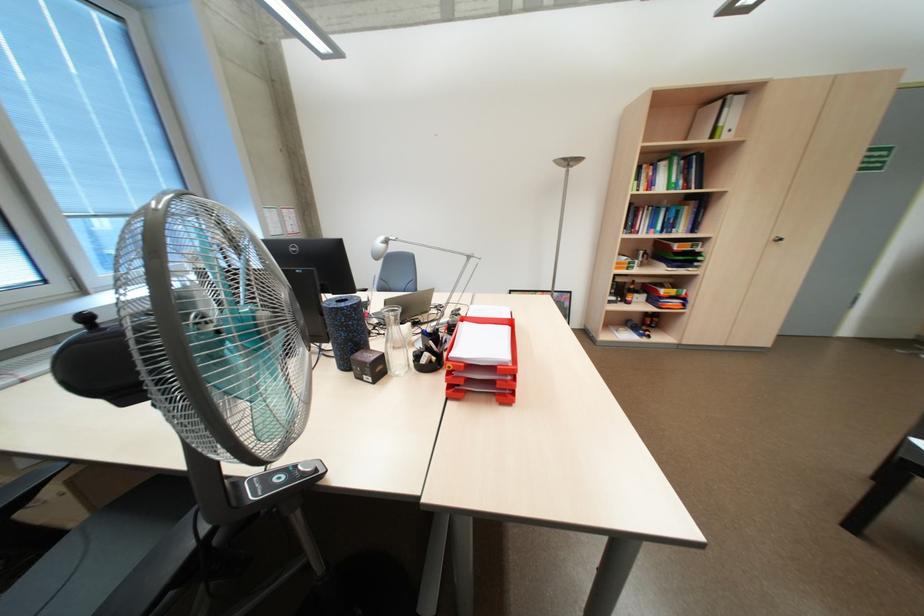
Where is `black chair armrest`? This screenshot has width=924, height=616. black chair armrest is located at coordinates (159, 570).